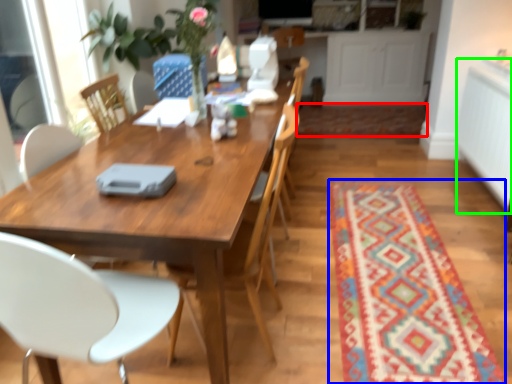
Question: Which object is the closest to the mat (highlighted by a red box)? Choose among these: mat (highlighted by a blue box) or counter top (highlighted by a green box).

Choices:
 (A) mat
 (B) counter top

Answer: (B)